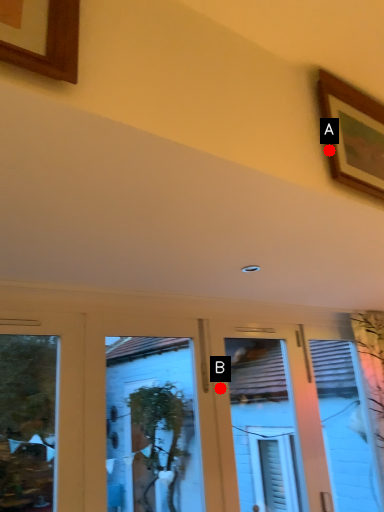
Question: Two points are circled on the image, labeled by A and B beside each circle. Which point is closer to the camera?

Choices:
 (A) A is closer
 (B) B is closer

Answer: (A)